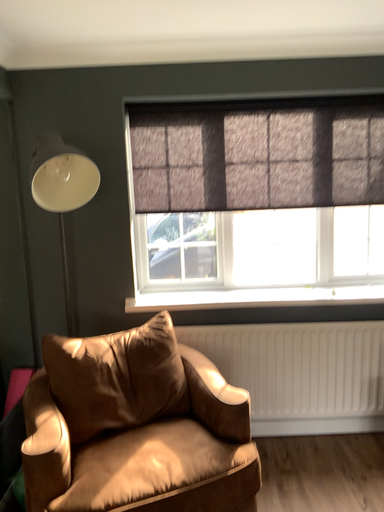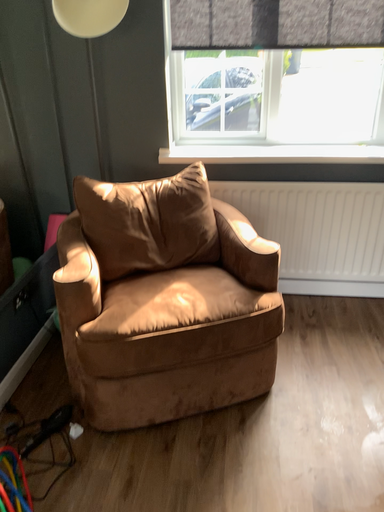
Question: How did the camera likely rotate when shooting the video?

Choices:
 (A) rotated upward
 (B) rotated downward

Answer: (B)